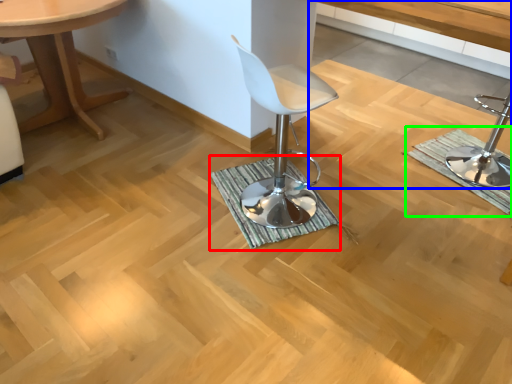
Question: Which object is the closest to the bath mat (highlighted by a red box)? Choose among these: vanity (highlighted by a blue box) or bath mat (highlighted by a green box).

Choices:
 (A) vanity
 (B) bath mat

Answer: (B)